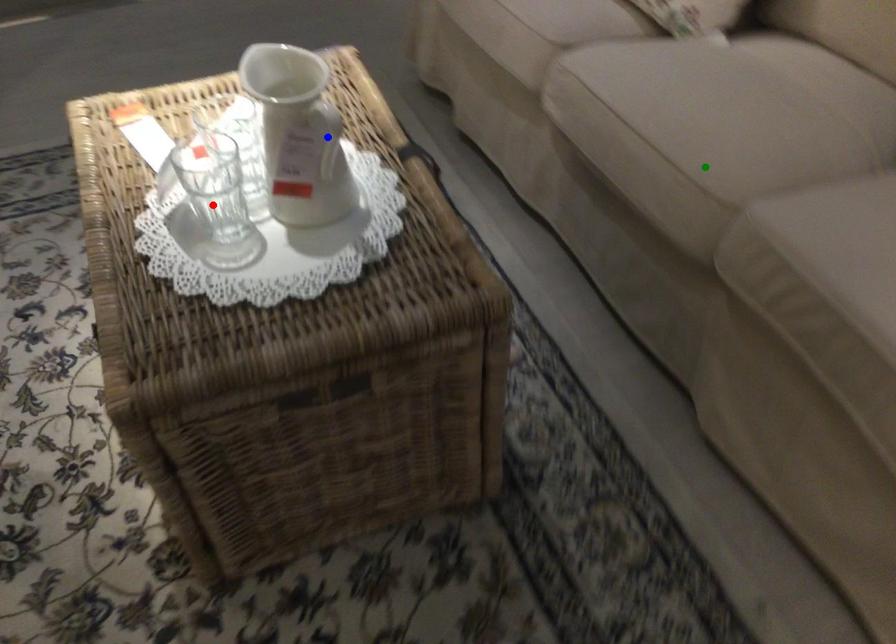
Order these from nearest to farthest:
1. red point
2. blue point
3. green point

1. green point
2. red point
3. blue point